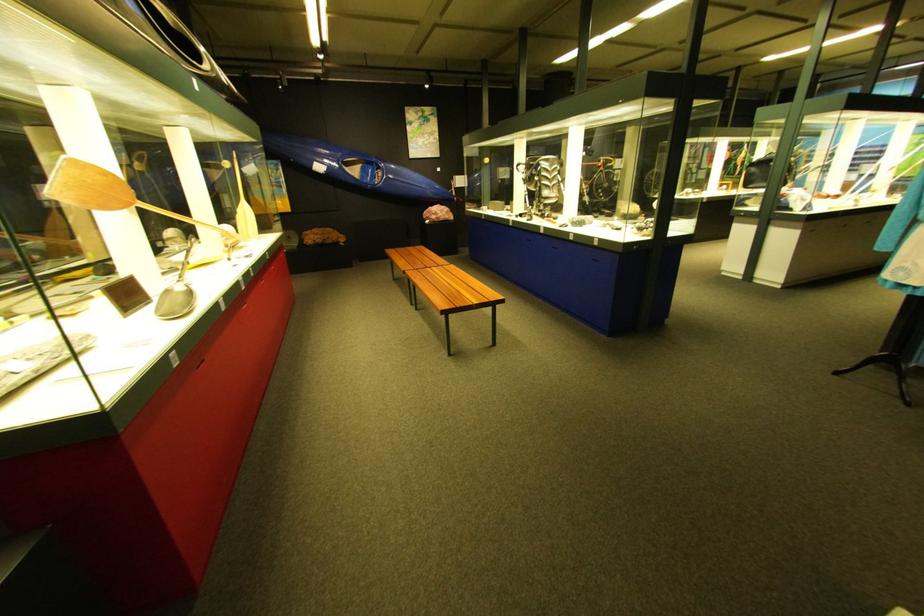
Image resolution: width=924 pixels, height=616 pixels. Describe the element at coordinates (603, 172) in the screenshot. I see `a bicycle handlebar` at that location.